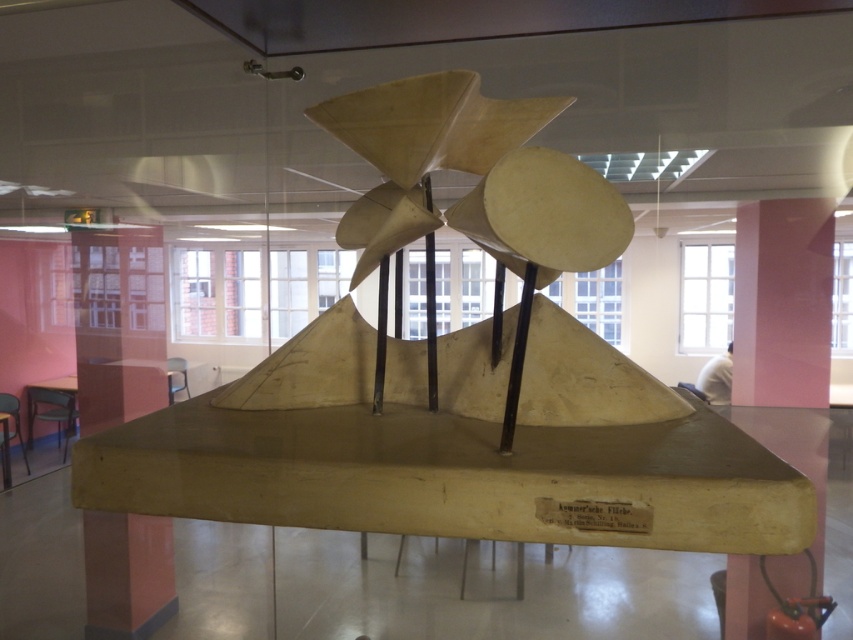
Which is more to the right, pink matte/wooden pillar at right or transparent glass pillar at left?

pink matte/wooden pillar at right

You are a GUI agent. You are given a task and a screenshot of the screen. Output one action in this format:
    pyautogui.click(x=<x>, y=<y>)
    Task: Click on the pink matte/wooden pillar at right
    
    Given the screenshot: What is the action you would take?
    pyautogui.click(x=782, y=301)

This screenshot has width=853, height=640. What are the coordinates of `pink matte/wooden pillar at right` in the screenshot? It's located at (782, 301).

Identify the location of pink matte/wooden pillar at right. This screenshot has height=640, width=853. (782, 301).